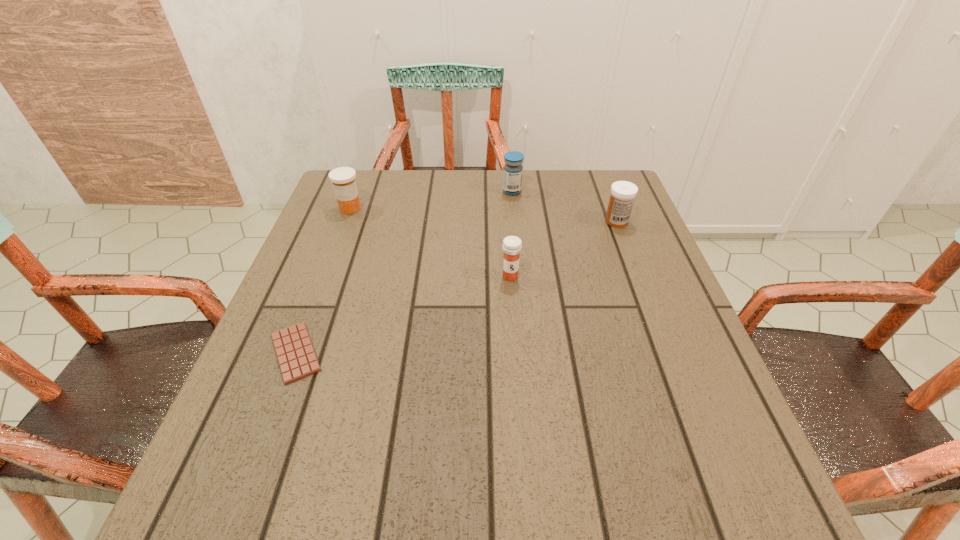
This screenshot has height=540, width=960. What are the coordinates of `free space between the farthest object and the candy bar` in the screenshot? It's located at (404, 272).

Where is `free point between the farthest object and the shortest object`? This screenshot has height=540, width=960. free point between the farthest object and the shortest object is located at coordinates (404, 272).

Find the location of `free space between the leftmost medicine and the farthest object`. free space between the leftmost medicine and the farthest object is located at coordinates (431, 200).

Identify which object is located as the third nearest to the rightmost medicine. Please provide its 2D coordinates. Your answer should be formatted as a tuple, i.e. [(x, y)], where the tuple contains the x and y coordinates of a point satisfying the conditions above.

[(343, 178)]

Find the location of `object that stands as the second closest to the candy bar`. object that stands as the second closest to the candy bar is located at coordinates (343, 178).

Image resolution: width=960 pixels, height=540 pixels. Find the location of `medicine that is the closest to the rightmost medicine`. medicine that is the closest to the rightmost medicine is located at coordinates (512, 181).

Locate which medicine is the closest to the leftmost medicine. Please provide its 2D coordinates. Your answer should be formatted as a tuple, i.e. [(x, y)], where the tuple contains the x and y coordinates of a point satisfying the conditions above.

[(512, 181)]

The width and height of the screenshot is (960, 540). What are the coordinates of `free space that satisfies the following two spatial constraints: 1. on the label of the leftmost medicine; 2. on the right side of the rightmost object` in the screenshot? It's located at (346, 221).

This screenshot has height=540, width=960. I want to click on free location that satisfies the following two spatial constraints: 1. on the back side of the rightmost object; 2. on the right side of the shortest object, so click(346, 221).

Identify the location of free point that satisfies the following two spatial constraints: 1. on the label of the rightmost object; 2. on the right side of the leftmost medicine. (346, 221).